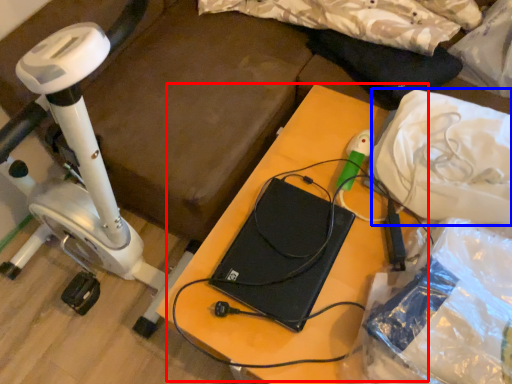
Question: Which of the following is the closest to the observer, table (highlighted by a red box) or material (highlighted by a blue box)?

Choices:
 (A) table
 (B) material

Answer: (A)